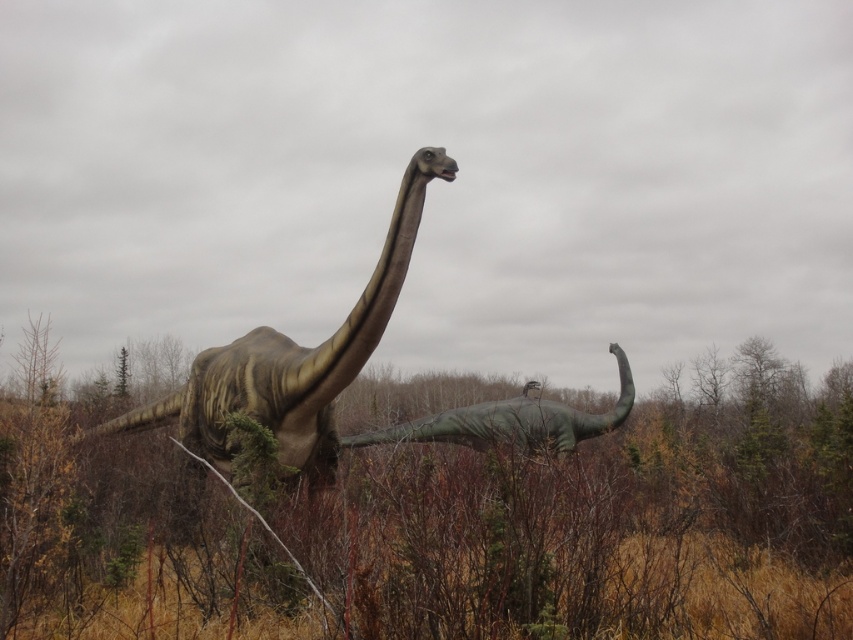
Is green matte foliage at center bigger than greenish-brown textured dinosaur at center?

Correct, green matte foliage at center is larger in size than greenish-brown textured dinosaur at center.

Between green matte foliage at center and greenish-brown textured dinosaur at center, which one appears on the left side from the viewer's perspective?

From the viewer's perspective, greenish-brown textured dinosaur at center appears more on the left side.

Between point (106, 576) and point (357, 369), which one is positioned behind?

The point (357, 369) is behind.

Identify the location of green matte foliage at center. The height and width of the screenshot is (640, 853). (595, 524).

Does green matte foliage at center come behind green matte dinosaur at center?

No, green matte foliage at center is in front of green matte dinosaur at center.

Is green matte foliage at center positioned before green matte dinosaur at center?

Yes, it is.

Is point (41, 608) closer to viewer compared to point (563, 436)?

Yes, point (41, 608) is closer to viewer.

What are the coordinates of `green matte foliage at center` in the screenshot? It's located at (595, 524).

From the picture: Which is above, greenish-brown textured dinosaur at center or green matte dinosaur at center?

greenish-brown textured dinosaur at center

Is point (405, 237) farther from viewer compared to point (466, 444)?

That is False.

Is point (218, 452) positioned behind point (514, 445)?

Yes.

Where is `greenish-brown textured dinosaur at center`? The image size is (853, 640). greenish-brown textured dinosaur at center is located at coordinates (293, 362).